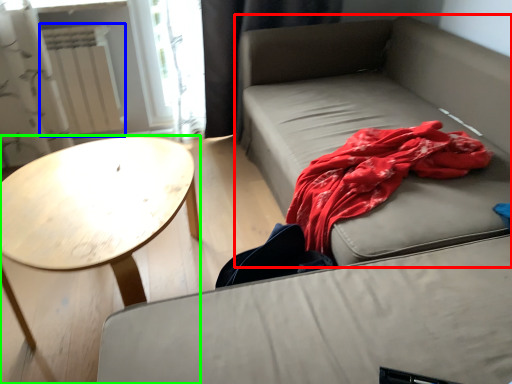
Question: Considering the real-world distances, which object is closest to studio couch (highlighted by a red box)? radiator (highlighted by a blue box) or coffee table (highlighted by a green box).

Choices:
 (A) radiator
 (B) coffee table

Answer: (B)